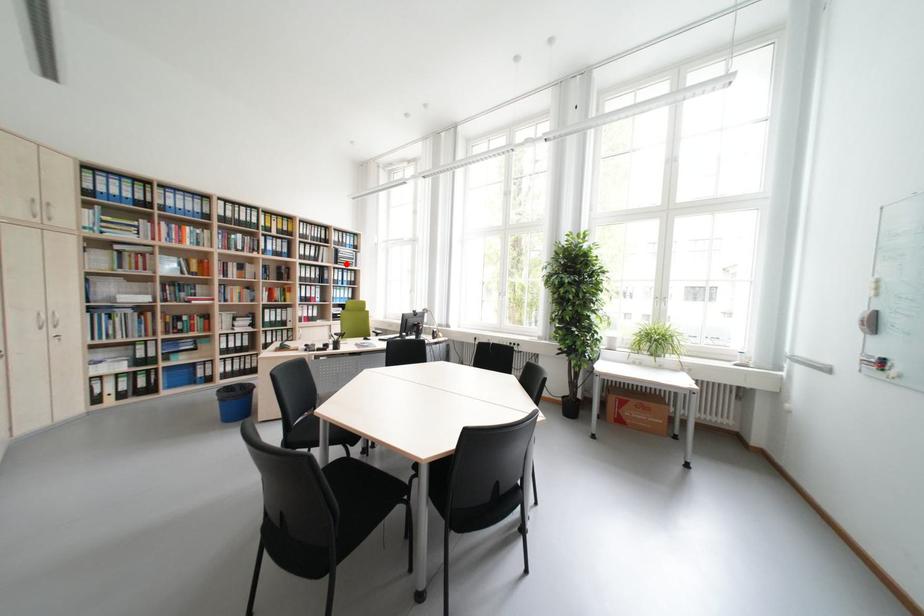
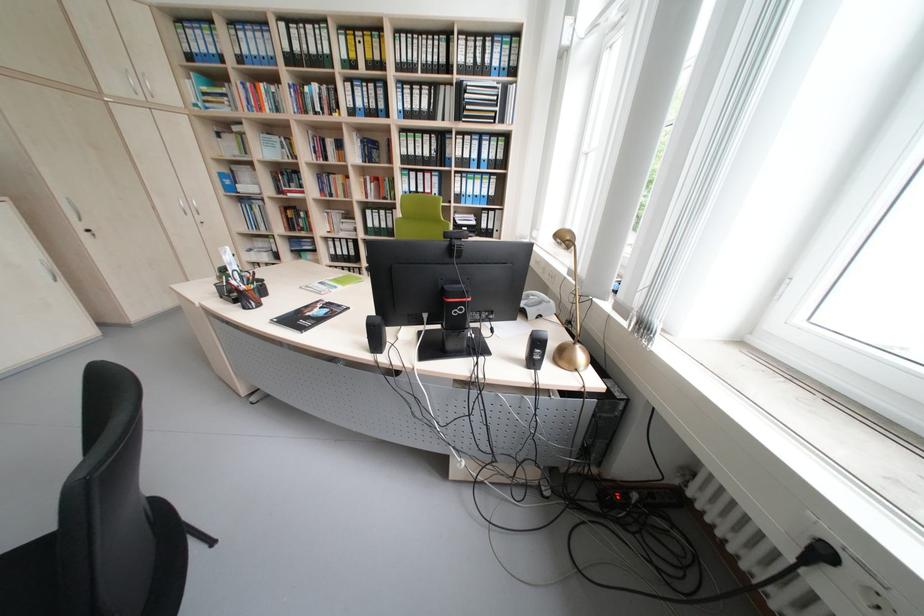
The point at the highlighted location is marked in the first image. Where is the corresponding point in the second image?

(468, 119)